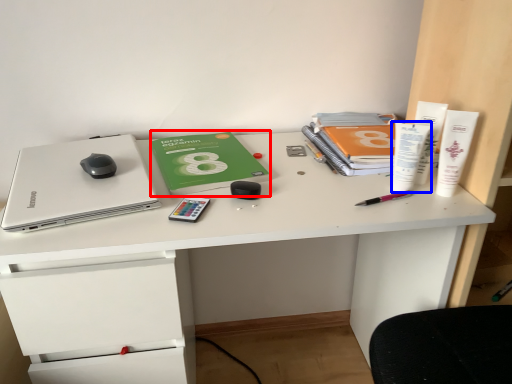
Question: Which object is further to the camera taking this photo, paperback book (highlighted by a red box) or stationery (highlighted by a blue box)?

Choices:
 (A) paperback book
 (B) stationery

Answer: (A)